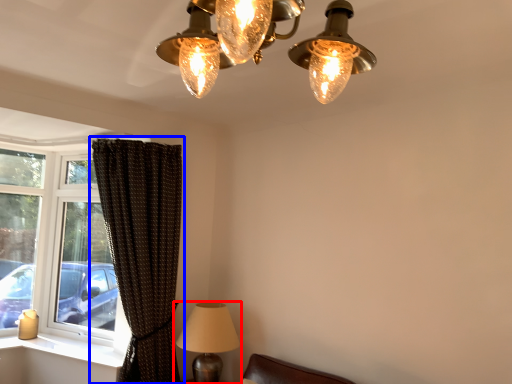
Question: Among these objects, which one is farthest to the camera, lamp (highlighted by a red box) or curtain (highlighted by a blue box)?

Choices:
 (A) lamp
 (B) curtain

Answer: (A)